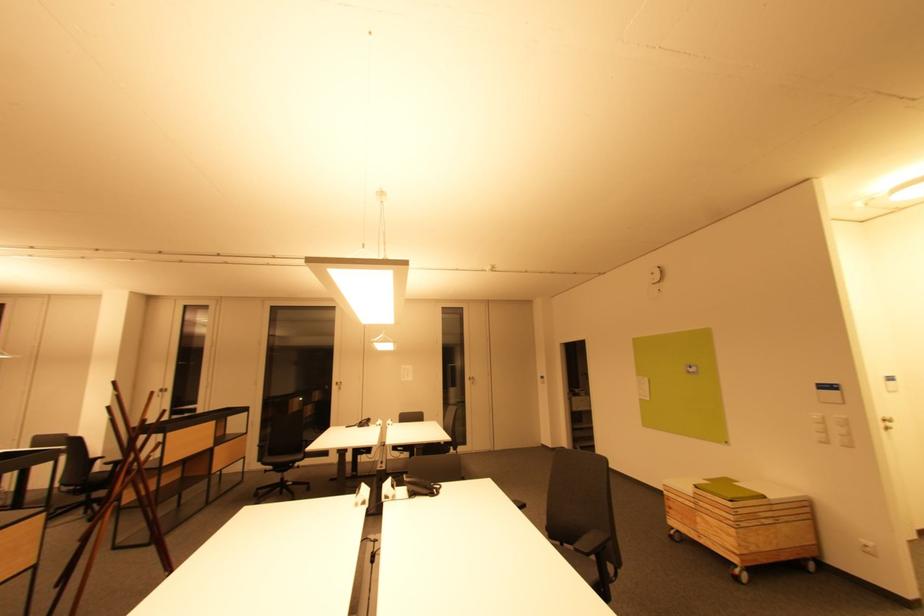
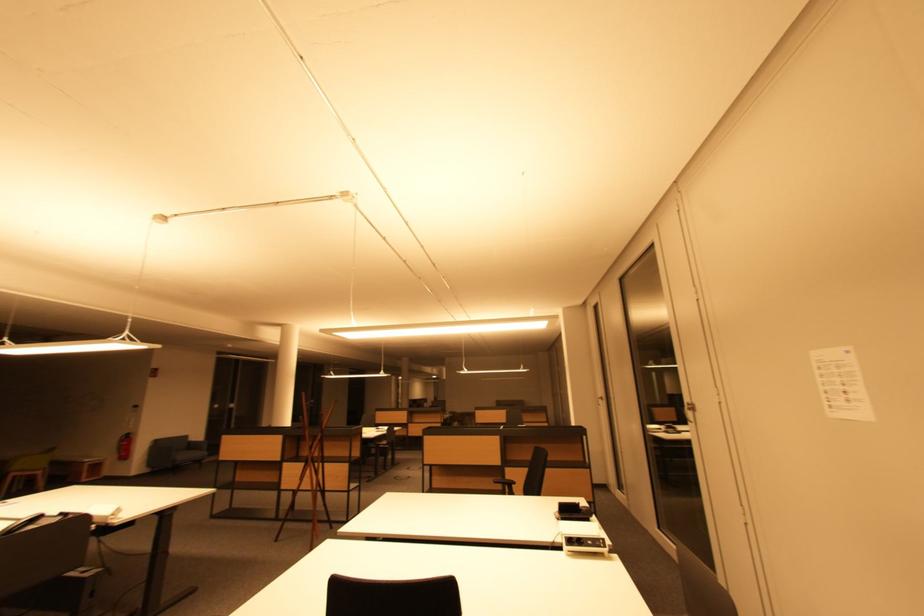
Locate, in the second image, the point that corresponds to point (407, 379) in the first image.

(834, 408)